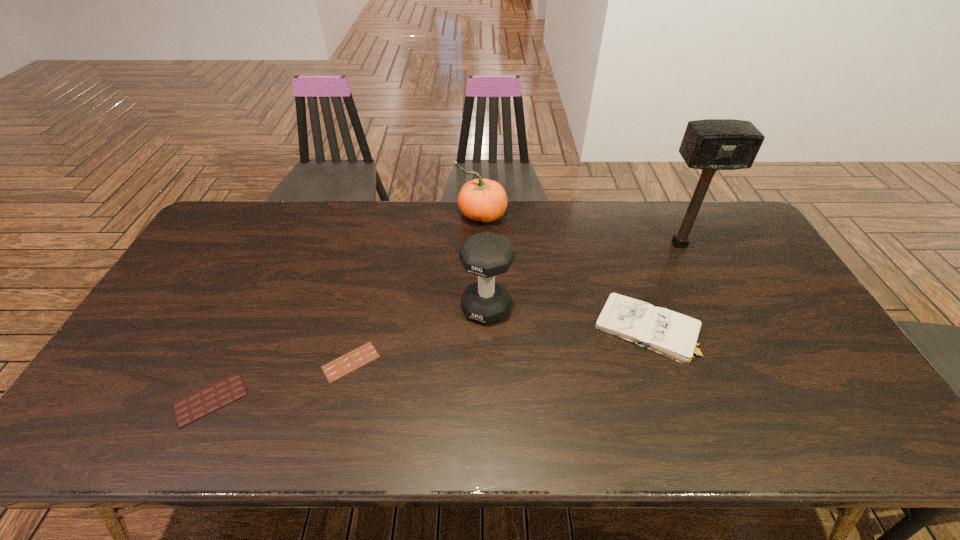
Image resolution: width=960 pixels, height=540 pixels. Find the location of `vacant space at the far left corner of the desktop`. vacant space at the far left corner of the desktop is located at coordinates (260, 209).

Find the location of a particular element. vacant space at the near left corner of the desktop is located at coordinates (117, 447).

Image resolution: width=960 pixels, height=540 pixels. In order to click on vacant area that lies between the right chocolate bar and the tallest object in this screenshot , I will do `click(515, 303)`.

Locate an element on the screen. The width and height of the screenshot is (960, 540). blank region between the dumbbell and the second object from left to right is located at coordinates (419, 335).

Where is `free space between the fourth tallest object and the mallet`? free space between the fourth tallest object and the mallet is located at coordinates (663, 287).

You are a GUI agent. You are given a task and a screenshot of the screen. Output one action in this format:
    pyautogui.click(x=<x>, y=<y>)
    Task: Click on the vacant point located between the third shortest object and the farthest object
    This screenshot has height=540, width=960.
    Given the screenshot: What is the action you would take?
    click(x=564, y=272)

Where is `free spot between the pumpkin and the tallest object`? free spot between the pumpkin and the tallest object is located at coordinates (581, 230).

Find the location of a particular element. This screenshot has width=960, height=540. free space between the left chocolate bar and the fourth tallest object is located at coordinates (429, 364).

Locate an element on the screen. The image size is (960, 540). unoccupied area between the shortest object and the notebook is located at coordinates (499, 346).

The width and height of the screenshot is (960, 540). Find the location of `vacant region between the dumbbell and the notebook`. vacant region between the dumbbell and the notebook is located at coordinates (566, 318).